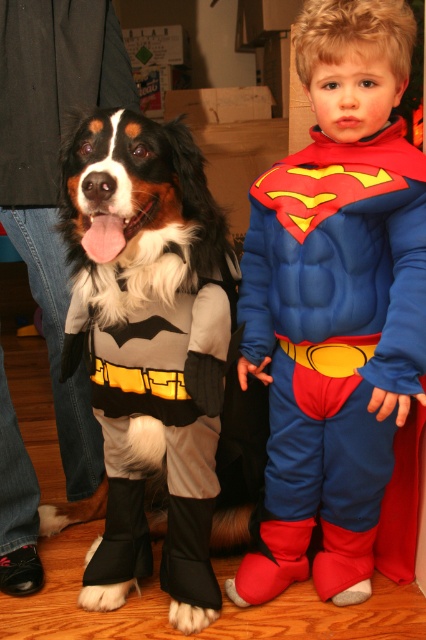
Between blue fleece suit at center and fluffy fur dog at center, which one is positioned lower?

Positioned lower is fluffy fur dog at center.

Can you confirm if blue fleece suit at center is taller than fluffy fur dog at center?

Indeed, blue fleece suit at center has a greater height compared to fluffy fur dog at center.

Is point (284, 337) farther from camera compared to point (129, 513)?

No, (284, 337) is in front of (129, 513).

Where is `blue fleece suit at center`? The image size is (426, 640). blue fleece suit at center is located at coordinates (336, 301).